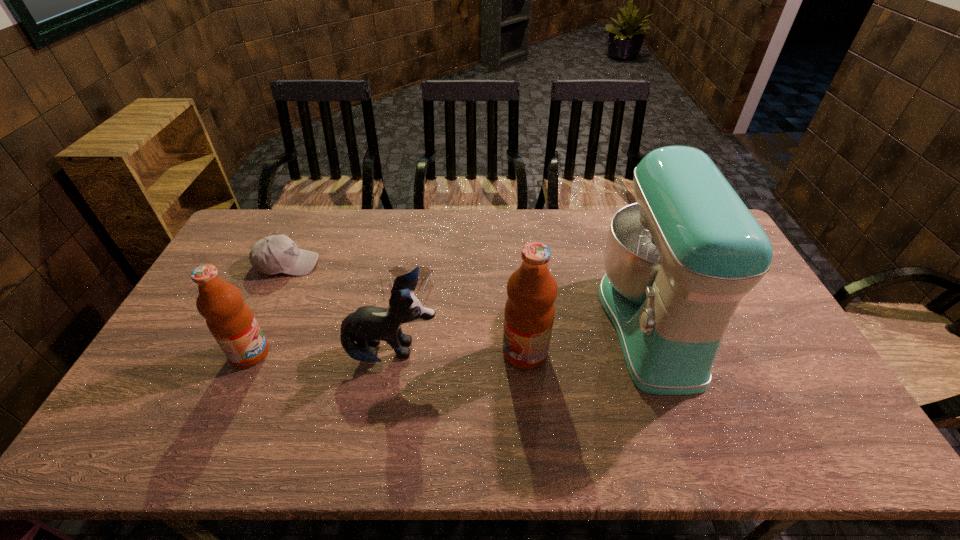
Where is `vacant space located on the front label of the taller fruit juice`? This screenshot has width=960, height=540. vacant space located on the front label of the taller fruit juice is located at coordinates [391, 353].

In order to click on free space located on the front label of the taller fruit juice in this screenshot , I will do `click(481, 353)`.

This screenshot has height=540, width=960. Identify the location of free region located on the front-facing side of the shortest object. (397, 373).

At what (x,y) coordinates should I click in order to perform the action: click on vacant space situated 0.120m on the front-facing side of the baseball cap. Please return your answer as a coordinate pair (x, y). The height and width of the screenshot is (540, 960). Looking at the image, I should click on (354, 264).

Locate an element on the screen. This screenshot has width=960, height=540. vacant space located at the base of the mixer is located at coordinates (566, 324).

This screenshot has height=540, width=960. In order to click on vacant space located at the base of the mixer in this screenshot , I will do `click(526, 324)`.

Where is `vacant space located at the base of the mixer`? vacant space located at the base of the mixer is located at coordinates (577, 324).

This screenshot has width=960, height=540. I want to click on free spot located 0.050m on the front-facing side of the puppy, so click(x=457, y=353).

Find the location of a particular element. The width and height of the screenshot is (960, 540). object positioned at the far edge is located at coordinates (274, 254).

This screenshot has width=960, height=540. In order to click on object situated at the near edge in this screenshot , I will do `click(678, 262)`.